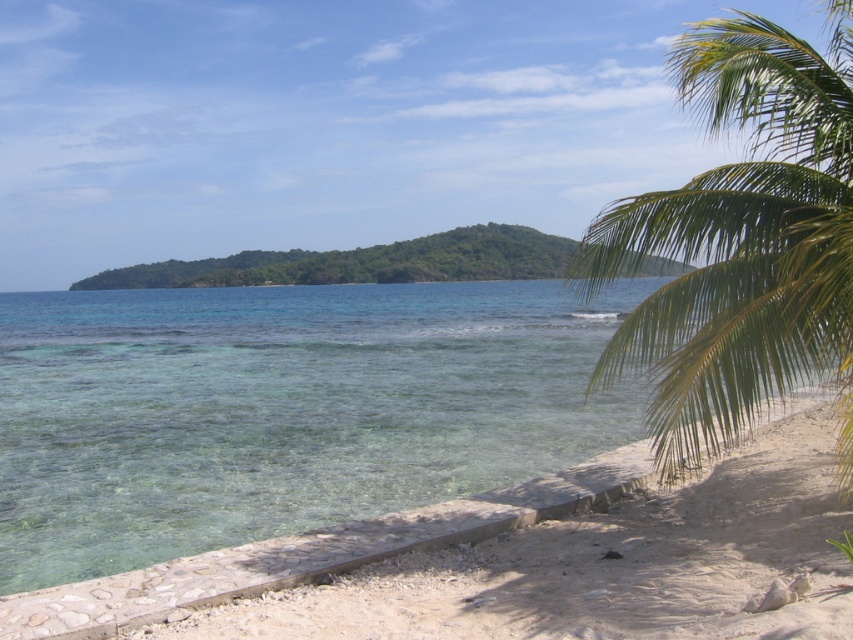
You are standing on the white sandy beach at lower right and want to walk to the green leafy island at center. Which direction should you head to reach the island?

You should head to the left to reach the green leafy island at center because the white sandy beach at lower right is to the right of the island.

You are standing at the edge of the beach and see two points marked in the image. Which point, point (813, 198) or point (514, 572), is closer to you?

Point (813, 198) is further to the viewer than point (514, 572), so the closer point to you is point (514, 572).